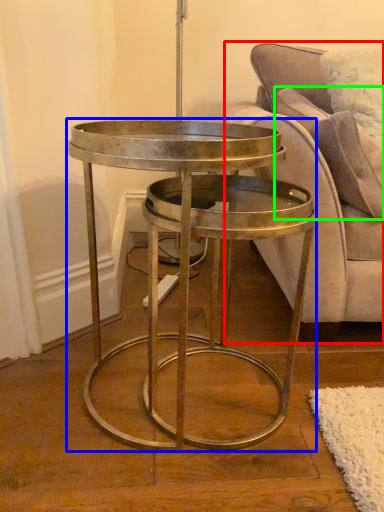
Question: Considering the real-world distances, which object is closest to studio couch (highlighted by a red box)? coffee table (highlighted by a blue box) or pillow (highlighted by a green box).

Choices:
 (A) coffee table
 (B) pillow

Answer: (B)